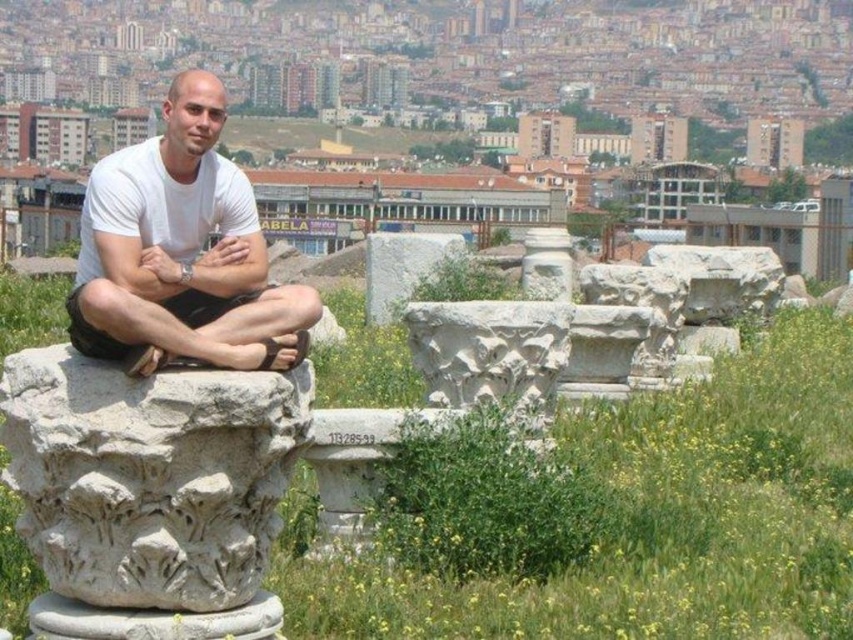
You are standing at the center of the image and want to find the white stone column at center. In which direction should you look relative to your current position?

The white stone column at center is located at the center of the image, so you should look straight ahead.